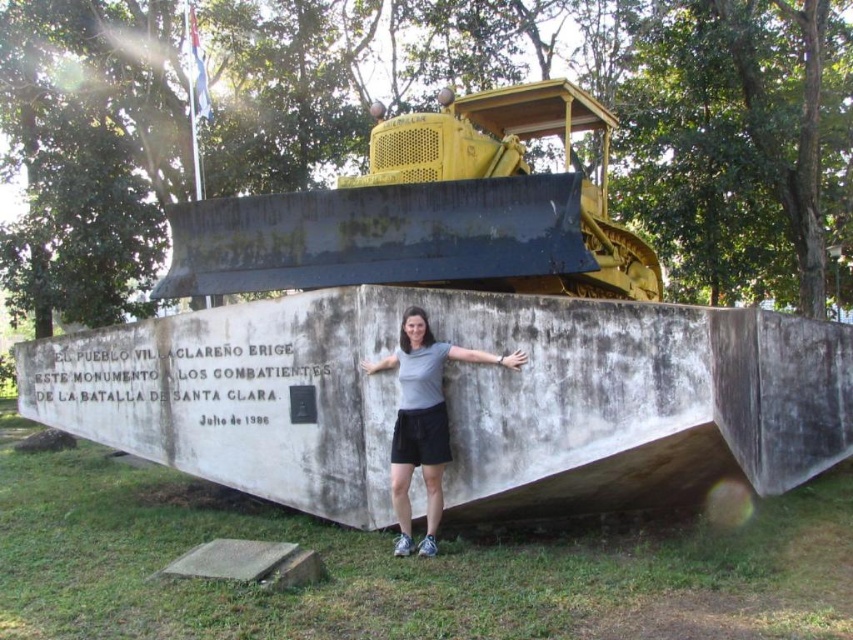
Is point (495, 204) positioned before point (437, 476)?

No, (495, 204) is further to viewer.

I want to click on yellow metallic bulldozer at upper center, so tap(431, 212).